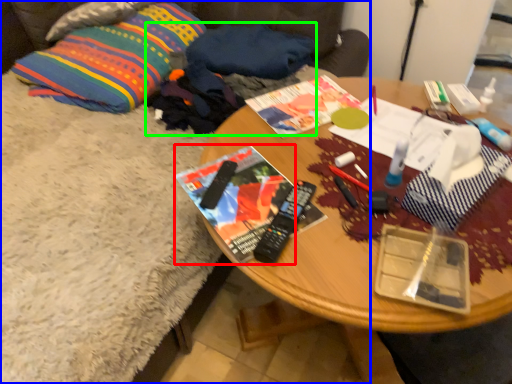
Question: Which is farther away from magazine (highlighted by a red box)? studio couch (highlighted by a blue box) or clothing (highlighted by a green box)?

Choices:
 (A) studio couch
 (B) clothing

Answer: (A)